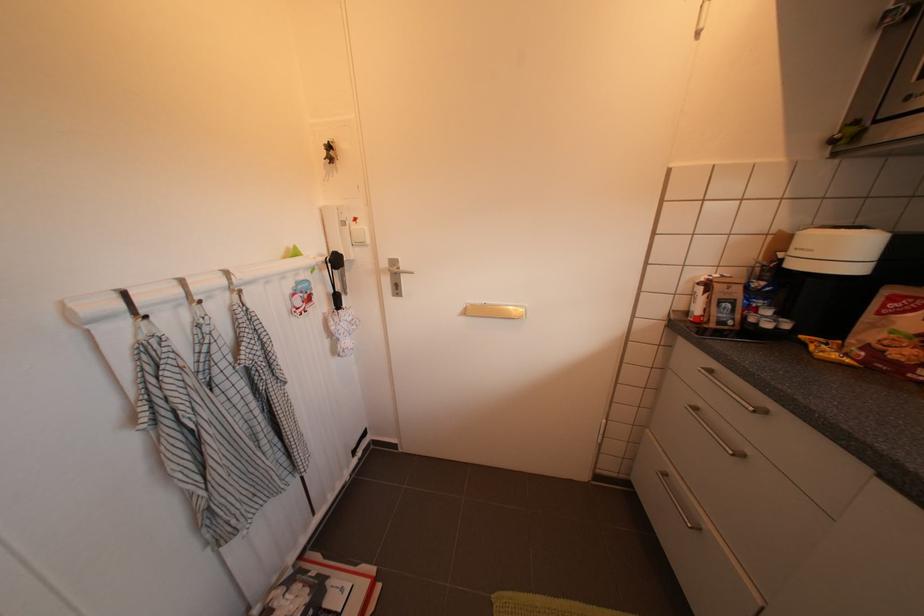
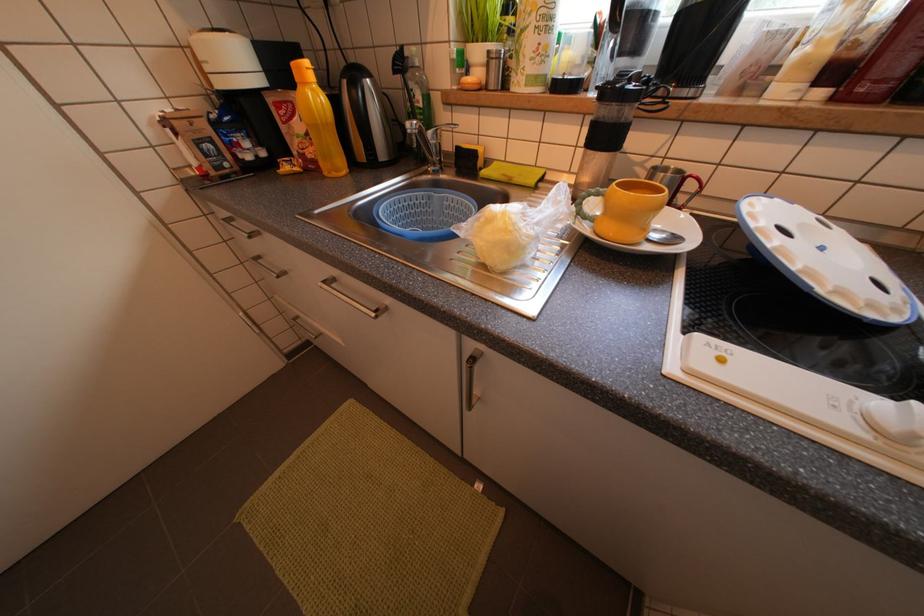
Based on the continuous images, in which direction is the camera rotating?

The camera rotated toward right-down.